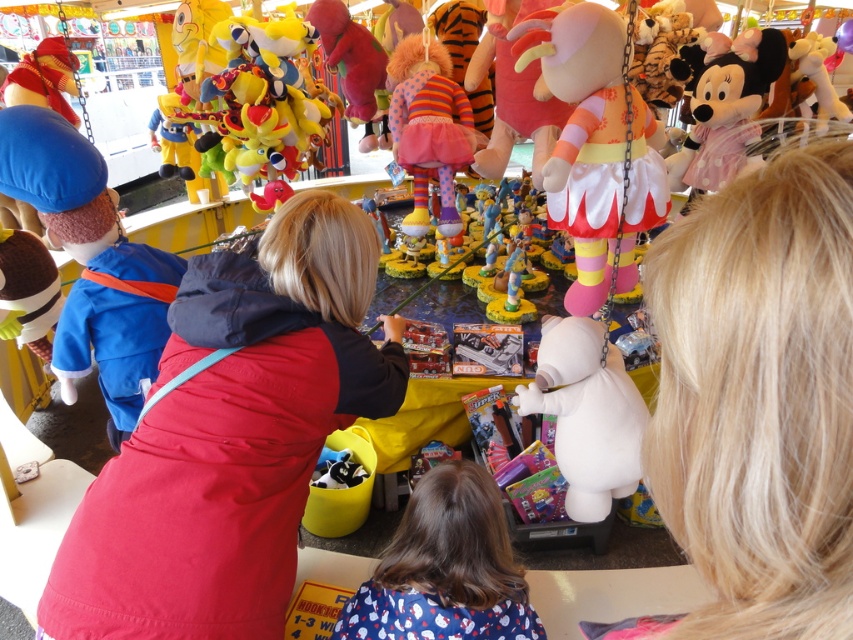
Is blonde hair at upper right to the right of matte pink plush at upper right from the viewer's perspective?

In fact, blonde hair at upper right is to the left of matte pink plush at upper right.

Can you confirm if blonde hair at upper right is positioned below matte pink plush at upper right?

Yes.

Identify the location of blonde hair at upper right. (759, 396).

Does blonde hair at upper right appear on the right side of striped fabric clown at center?

Indeed, blonde hair at upper right is positioned on the right side of striped fabric clown at center.

Is blonde hair at upper right wider than striped fabric clown at center?

No.

This screenshot has height=640, width=853. Identify the location of blonde hair at upper right. (759, 396).

Identify the location of blonde hair at upper right. The image size is (853, 640). (759, 396).

Is velvet blue coat at left closer to the viewer compared to matte red plush toy at left?

Yes.

Does velvet blue coat at left appear over matte red plush toy at left?

Actually, velvet blue coat at left is below matte red plush toy at left.

The width and height of the screenshot is (853, 640). I want to click on velvet blue coat at left, so click(231, 438).